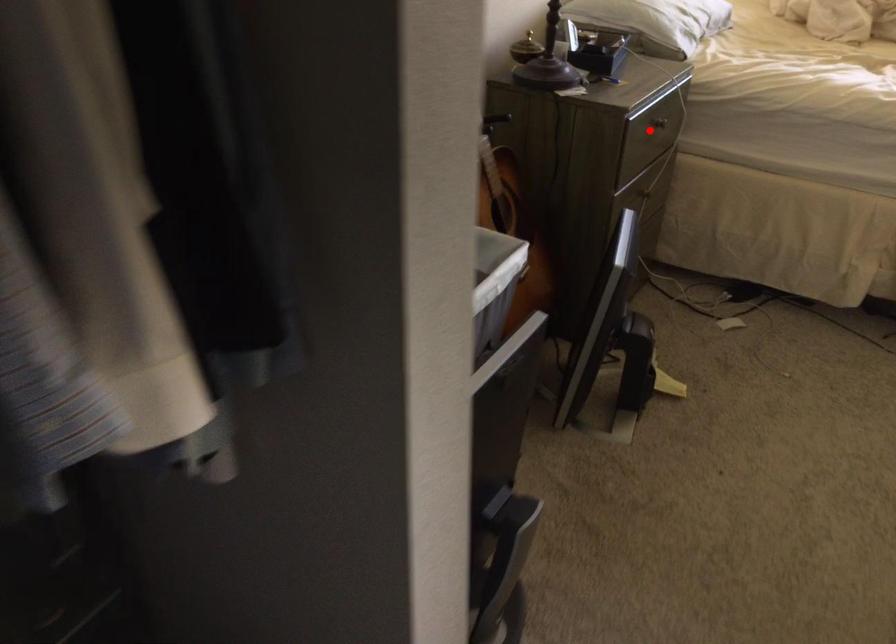
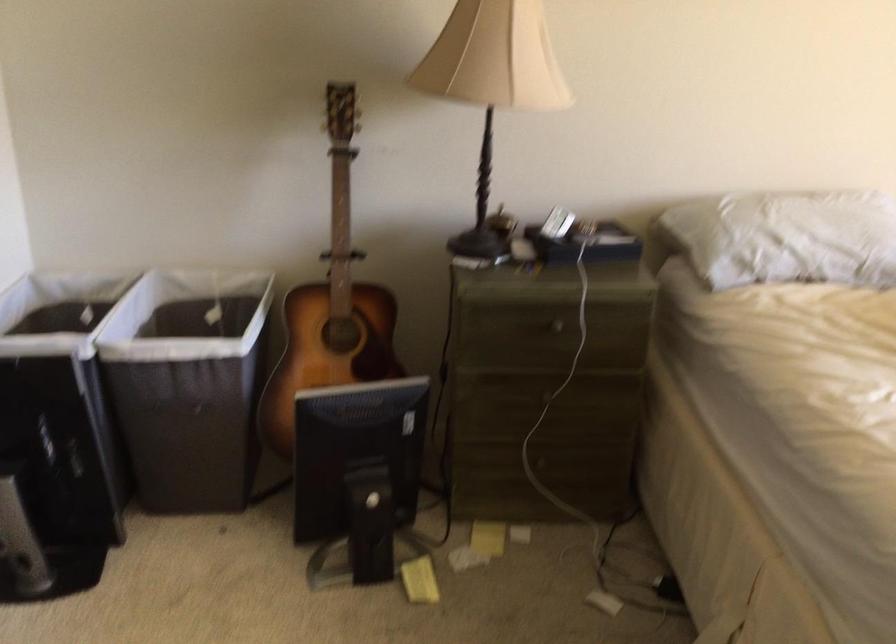
The point at the highlighted location is marked in the first image. Where is the corresponding point in the second image?

(545, 328)